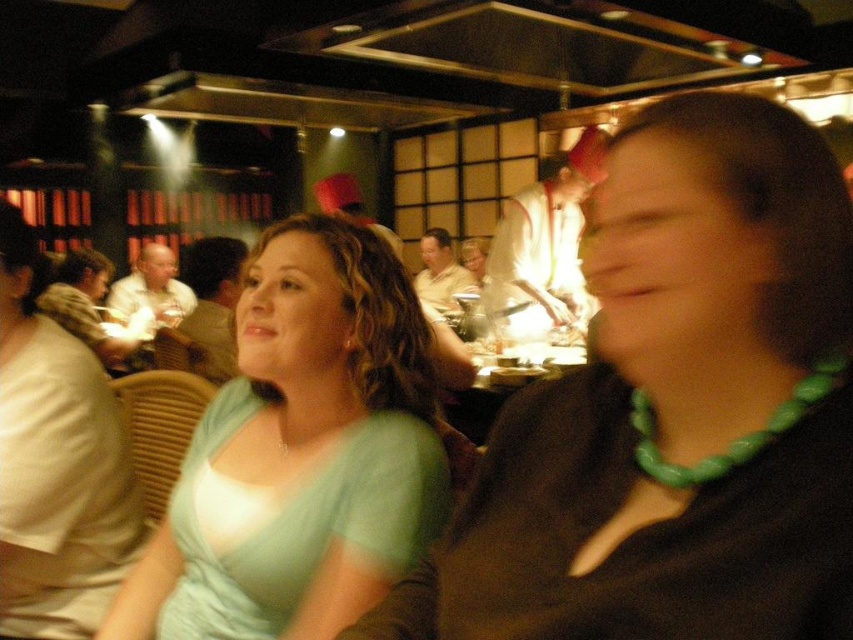
Question: Among these points, which one is nearest to the camera?

Choices:
 (A) click(x=364, y=216)
 (B) click(x=741, y=444)
 (C) click(x=201, y=609)
 (D) click(x=51, y=621)

Answer: (B)

Question: Can you confirm if light green fabric dress at upper left is smaller than white shirt at center?

Choices:
 (A) yes
 (B) no

Answer: (A)

Question: In this image, where is light green fabric dress at upper left located relative to white glossy chef at center?

Choices:
 (A) right
 (B) left

Answer: (B)

Question: Does green beaded necklace at center come behind light green fabric dress at upper left?

Choices:
 (A) yes
 (B) no

Answer: (B)

Question: Which point is closer to the camera?

Choices:
 (A) pyautogui.click(x=267, y=339)
 (B) pyautogui.click(x=437, y=269)

Answer: (A)

Question: Which point is farther to the camera?

Choices:
 (A) matte black chef hat at center
 (B) green beaded necklace at center
 (C) white shirt at center
 (D) green beaded necklace at right

Answer: (C)